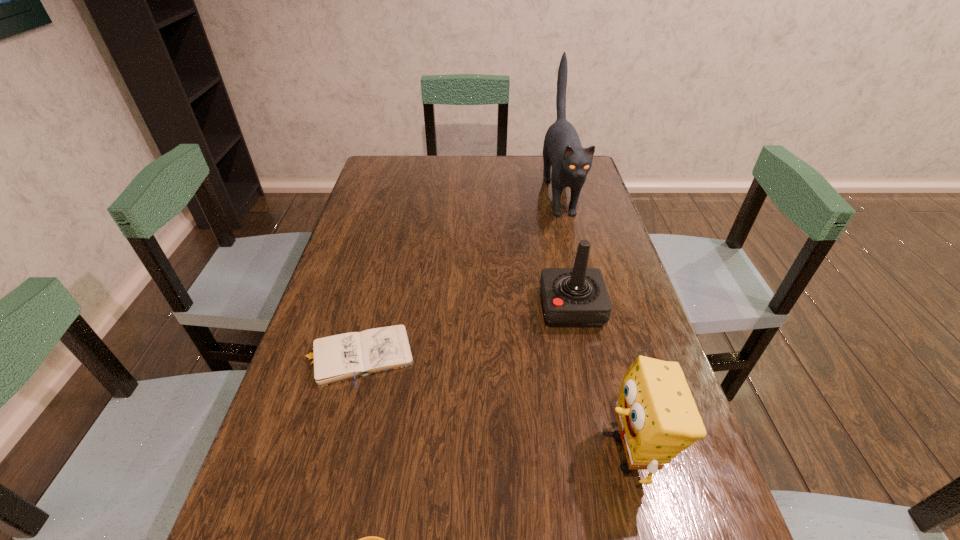
Where is `free location located 0.070m on the face of the sponge`? free location located 0.070m on the face of the sponge is located at coordinates (564, 453).

Where is `vacant region located 0.170m on the face of the sponge`? vacant region located 0.170m on the face of the sponge is located at coordinates pyautogui.click(x=510, y=453).

You are a GUI agent. You are given a task and a screenshot of the screen. Output one action in this format:
    pyautogui.click(x=<x>, y=<y>)
    Task: Click on the vacant space located on the right of the shortest object
    This screenshot has height=540, width=960.
    Given the screenshot: What is the action you would take?
    pyautogui.click(x=560, y=356)

Identify the location of object at the far edge. (562, 150).

At what (x,y) coordinates should I click in order to perform the action: click on object at the left edge. Please return your answer as a coordinate pair (x, y). Looking at the image, I should click on (337, 358).

Where is `cat at the right edge`? This screenshot has height=540, width=960. cat at the right edge is located at coordinates (562, 150).

This screenshot has height=540, width=960. In order to click on joystick located at the right edge in this screenshot , I will do `click(572, 297)`.

The width and height of the screenshot is (960, 540). Find the location of `sponge positioned at the right edge`. sponge positioned at the right edge is located at coordinates (657, 417).

Locate an element on the screen. The height and width of the screenshot is (540, 960). object at the far right corner is located at coordinates (562, 150).

Where is `free location at the far edge`? free location at the far edge is located at coordinates (473, 166).